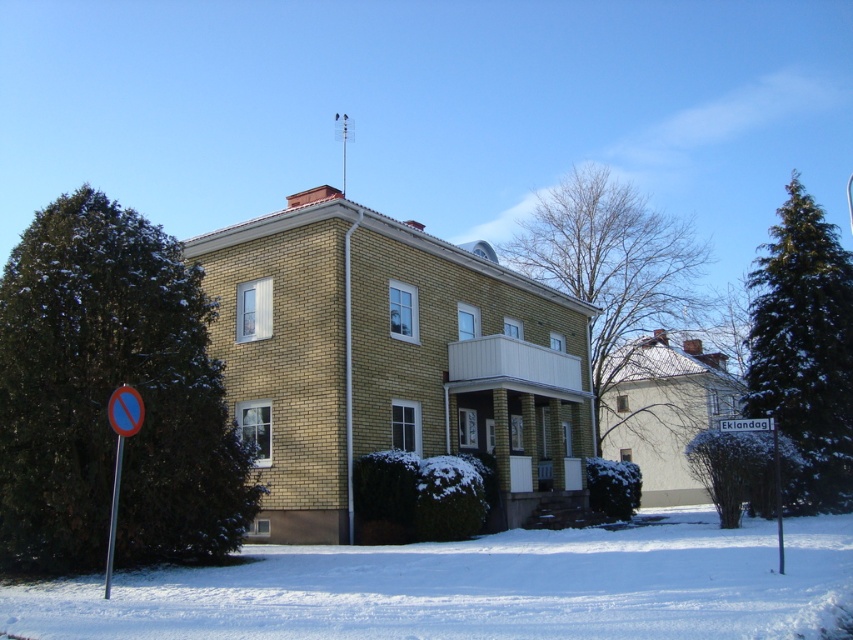
Question: Is green leafy tree at left wider than bare branches at upper center?

Choices:
 (A) no
 (B) yes

Answer: (A)

Question: Estimate the real-world distances between objects in this image. Which object is closer to the bare branches at upper center?

Choices:
 (A) white powdery snow at lower center
 (B) green leafy tree at left

Answer: (A)

Question: Which object is farther from the camera taking this photo?

Choices:
 (A) metallic circular sign at lower left
 (B) blue reflective plastic sign at lower left

Answer: (A)

Question: Does metallic pole at center appear on the left side of white plastic sign at center?

Choices:
 (A) no
 (B) yes

Answer: (A)

Question: Which point is closer to the camera taking this photo?

Choices:
 (A) (415, 596)
 (B) (108, 412)
 (C) (751, 428)
 (D) (804, 221)

Answer: (A)

Question: Can you confirm if metallic circular sign at lower left is wider than white plastic sign at center?

Choices:
 (A) yes
 (B) no

Answer: (B)